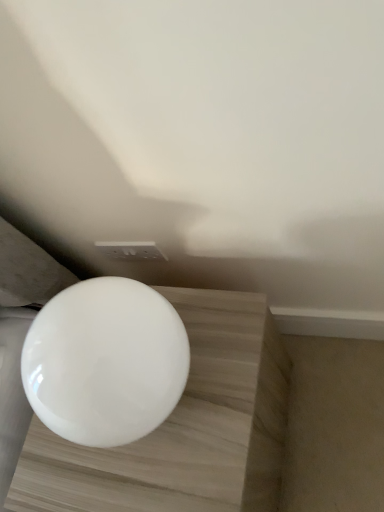
Identify the location of blank space situated above white glossy sphere at center (from a real-world perspective). This screenshot has height=512, width=384. (160, 429).